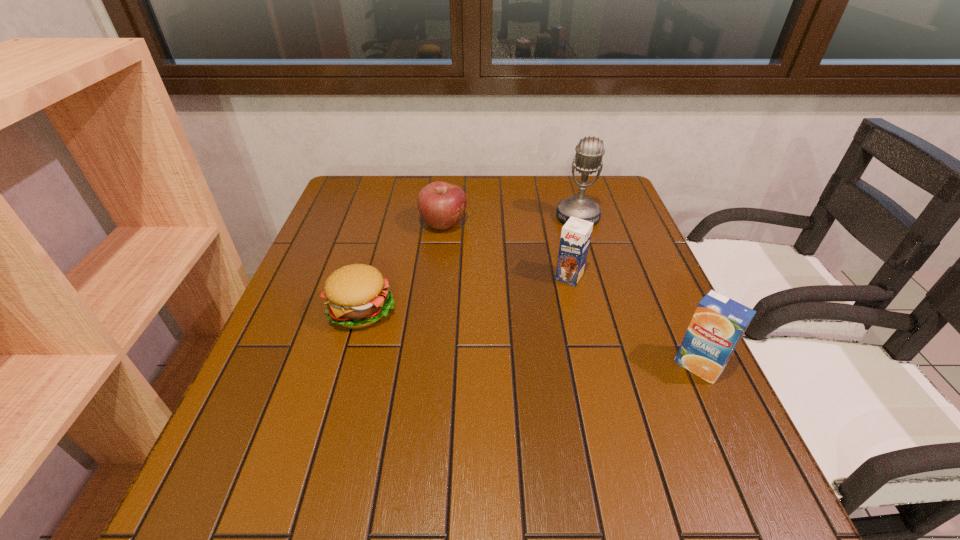
You are a GUI agent. You are given a task and a screenshot of the screen. Output one action in this format:
    pyautogui.click(x=<x>, y=<y>)
    Task: Click on the blank area in the image that satisfies the following two spatial constraints: 1. on the back side of the chocolate milk; 2. on the right side of the tallest object
    
    Given the screenshot: What is the action you would take?
    pyautogui.click(x=555, y=217)

You are a GUI agent. You are given a task and a screenshot of the screen. Output one action in this format:
    pyautogui.click(x=<x>, y=<y>)
    Task: Click on the free location that satisfies the following two spatial constraints: 1. on the back side of the tallest object; 2. on the right side of the chocolate milk
    This screenshot has height=540, width=960.
    Given the screenshot: What is the action you would take?
    pyautogui.click(x=555, y=217)